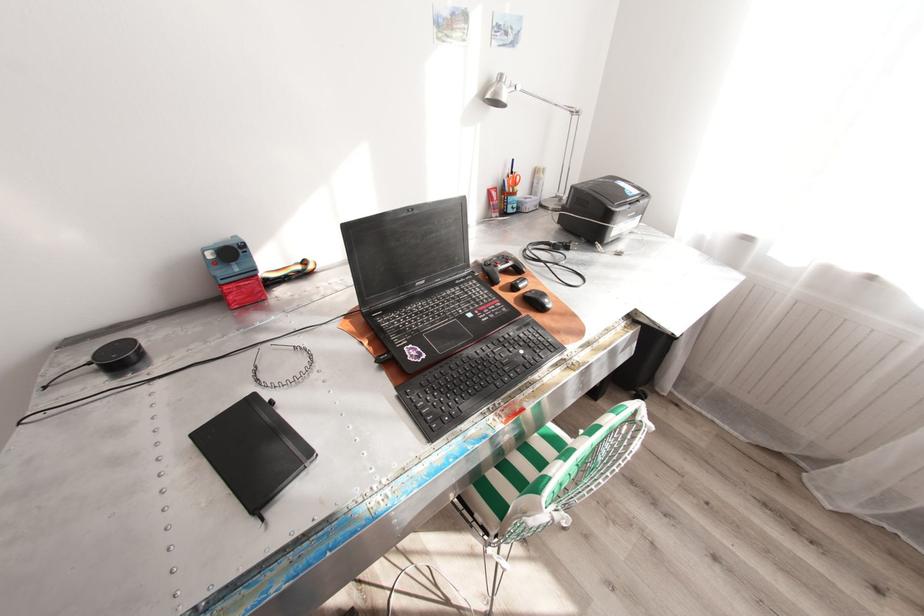
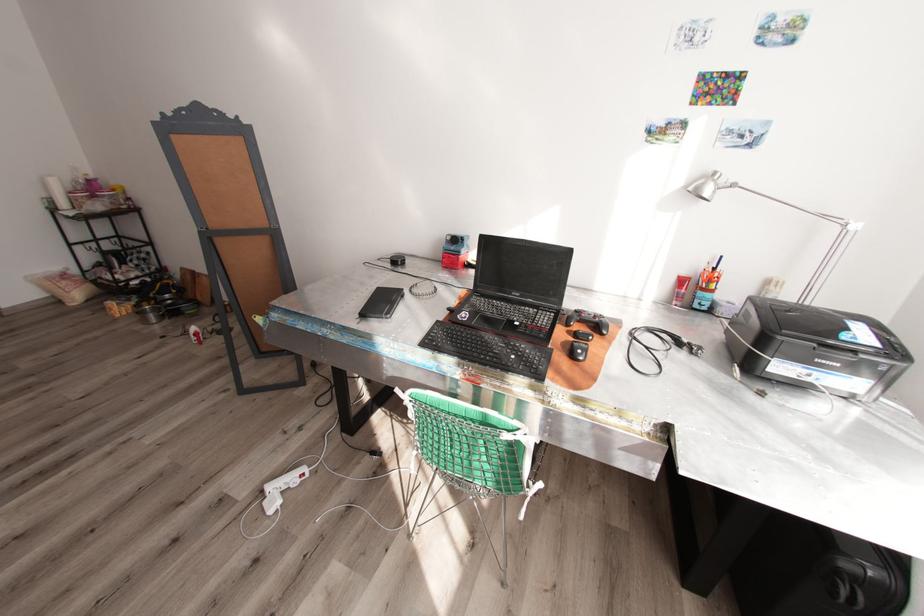
Find the pixel in the second image that matches point (515, 209) in the first image.

(699, 305)